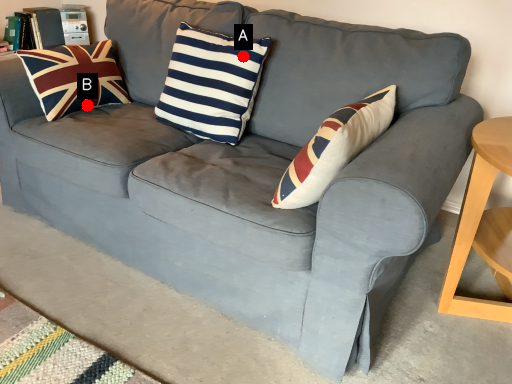
Question: Two points are circled on the image, labeled by A and B beside each circle. Which point is closer to the camera?

Choices:
 (A) A is closer
 (B) B is closer

Answer: (A)